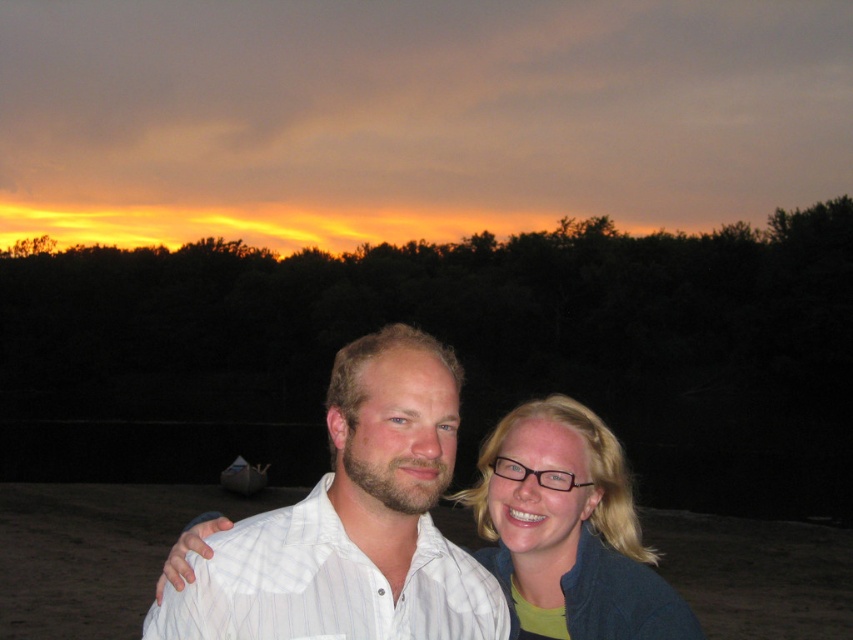
Is white striped shirt at center positioned at the back of blonde hair at center?

That is False.

Can you confirm if white striped shirt at center is positioned to the left of blonde hair at center?

Yes, white striped shirt at center is to the left of blonde hair at center.

The width and height of the screenshot is (853, 640). Find the location of `white striped shirt at center`. white striped shirt at center is located at coordinates (352, 522).